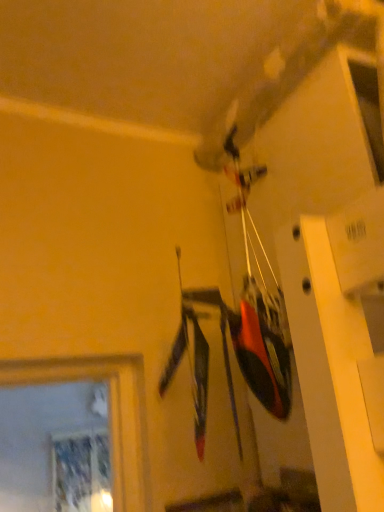
You are a GUI agent. You are given a task and a screenshot of the screen. Output one action in this format:
    pyautogui.click(x=<x>, y=<y>)
    Task: Click on the transparent glass window at lower left
    
    Given the screenshot: What is the action you would take?
    pyautogui.click(x=81, y=472)

The height and width of the screenshot is (512, 384). What do you see at coordinates (81, 472) in the screenshot? I see `transparent glass window at lower left` at bounding box center [81, 472].

Measure the distance between point (x=73, y=488) and camera.

The depth of point (x=73, y=488) is 4.23 meters.

This screenshot has height=512, width=384. I want to click on transparent glass window at lower left, so click(x=81, y=472).